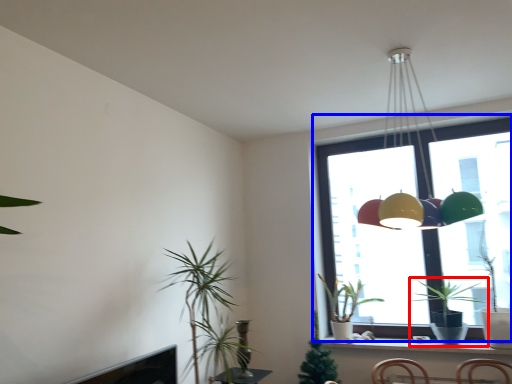
Question: Which of the following is the farthest to the observer, houseplant (highlighted by a red box) or window (highlighted by a blue box)?

Choices:
 (A) houseplant
 (B) window

Answer: (B)